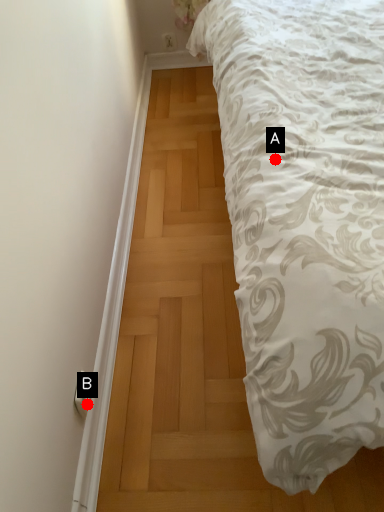
Question: Two points are circled on the image, labeled by A and B beside each circle. Which point is farther to the camera?

Choices:
 (A) A is further
 (B) B is further

Answer: (B)